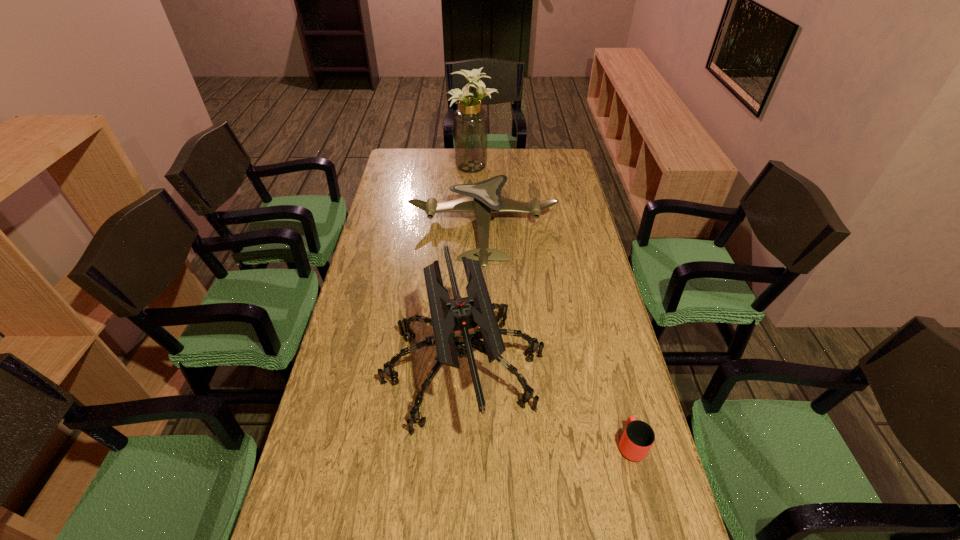
Locate an element on the screen. The width and height of the screenshot is (960, 540). free spot located on the front-facing side of the farther drone is located at coordinates (484, 298).

Identify the location of free space located 0.290m on the handle side of the rightmost object. This screenshot has height=540, width=960. (x=604, y=337).

The image size is (960, 540). Find the location of `vacant region located 0.180m on the handle side of the rightmost object`. vacant region located 0.180m on the handle side of the rightmost object is located at coordinates (612, 367).

Identify the location of vacant space positioned 0.290m on the handle side of the rightmost object. The width and height of the screenshot is (960, 540). point(604,337).

At what (x,y) coordinates should I click in order to perform the action: click on object that is at the far edge. Please return your answer as a coordinate pair (x, y). Looking at the image, I should click on (470, 121).

What are the coordinates of `drone that is at the right edge` in the screenshot? It's located at (483, 198).

The width and height of the screenshot is (960, 540). Identify the location of cup present at the right edge. (638, 437).

At what (x,y) coordinates should I click in order to perform the action: click on free space at the far edge of the desktop. Please return your answer as a coordinate pair (x, y). The width and height of the screenshot is (960, 540). Looking at the image, I should click on (434, 173).

In the image, there is a desktop. Where is `free space at the left edge`? free space at the left edge is located at coordinates (318, 534).

You are a GUI agent. You are given a task and a screenshot of the screen. Output one action in this format:
    pyautogui.click(x=<x>, y=<y>)
    Task: Click on the vacant position at the right edge of the desktop
    This screenshot has height=540, width=960.
    Given the screenshot: What is the action you would take?
    596,389